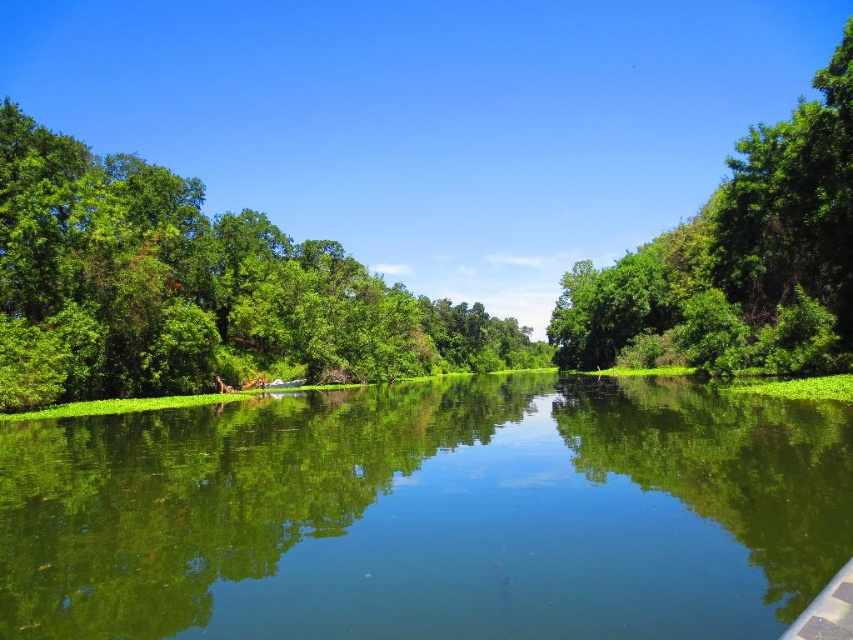
You are standing on the bank of the river and want to take a photo of the green leafy tree at right and its reflection in the green reflective water at center. Based on the scene, where should you position yourself to capture both the tree and its reflection?

You should position yourself on the bank of the river below the green leafy tree at right because the green reflective water at center is located below it, allowing you to capture both the tree and its reflection in the water.